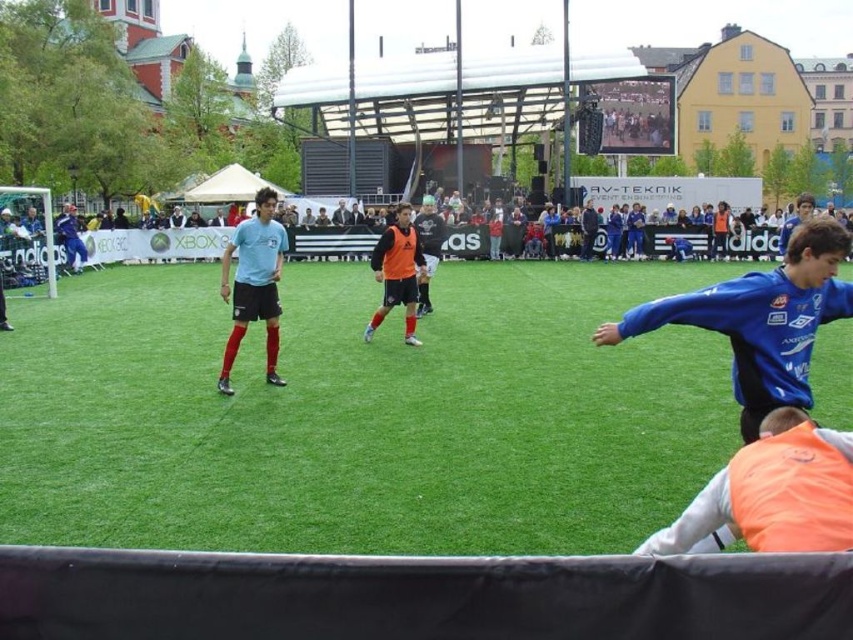
You are a photographer at the soccer match. You want to take a photo that includes both the orange matte vest at center and the orange jersey at center. Which one should you adjust your camera angle to focus on first to ensure both are in frame?

You should focus on the orange jersey at center first since the orange matte vest at center is to the left of it, ensuring both are captured by adjusting the angle from the right towards the left.

You are standing at the point labeled as point [851,506] on the field. You want to throw a ball to your teammate who is exactly 30 feet away from you. Can you reach your teammate with one throw?

The distance between you and your teammate is 29.13 feet, which is less than 30 feet. Therefore, you can reach your teammate with one throw.

You are a soccer referee observing the field. You notice the green artificial turf at center and the orange jersey at center. Which object is closer to you?

The green artificial turf at center is closer to you because it is in front of the orange jersey at center.